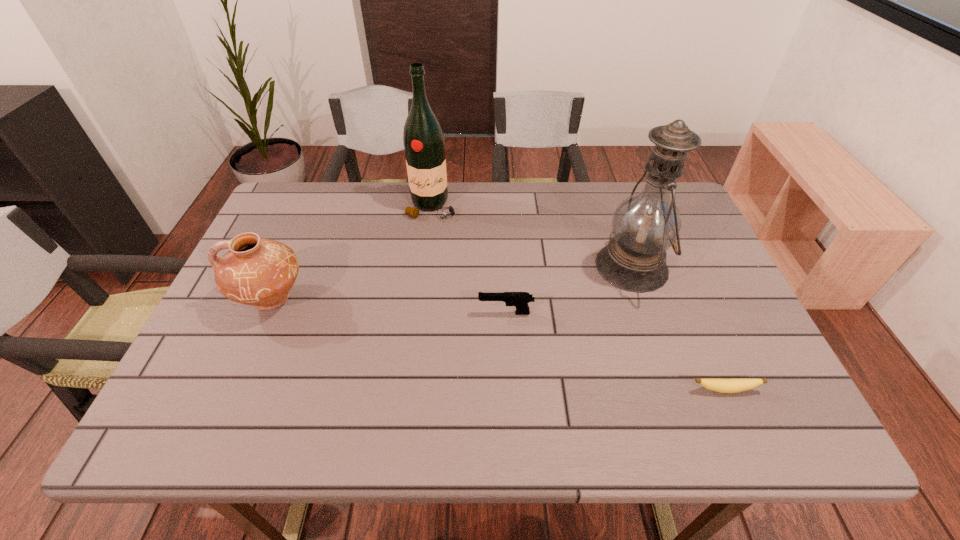
Where is `wine bottle`? The width and height of the screenshot is (960, 540). wine bottle is located at coordinates (424, 145).

Identify the location of the farthest object. (424, 145).

Identify the location of oil lamp. Image resolution: width=960 pixels, height=540 pixels. (645, 225).

At what (x,y) coordinates should I click in order to perform the action: click on the leftmost object. Please return your answer as a coordinate pair (x, y). The width and height of the screenshot is (960, 540). Looking at the image, I should click on (258, 272).

This screenshot has width=960, height=540. I want to click on pottery, so click(x=258, y=272).

Find the location of `the second shortest object`. the second shortest object is located at coordinates (520, 300).

The width and height of the screenshot is (960, 540). Identify the location of the third object from left to right. (520, 300).

This screenshot has height=540, width=960. In order to click on the nearest object in this screenshot , I will do `click(719, 385)`.

I want to click on the shortest object, so click(x=719, y=385).

Where is `free spot located 0.340m on the surface of the wine bottle`? free spot located 0.340m on the surface of the wine bottle is located at coordinates (419, 313).